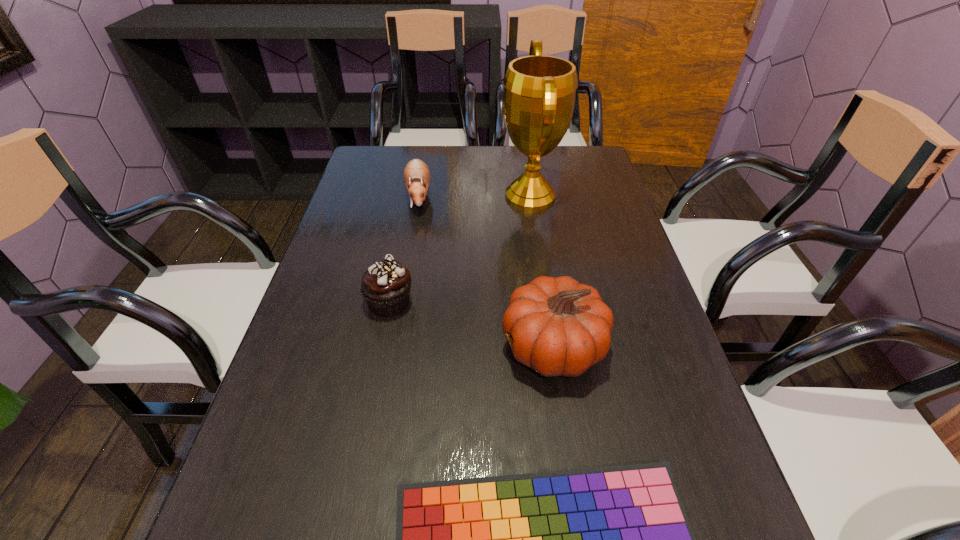
At what (x,y) coordinates should I click in order to perform the action: click on blank space located on the back of the cupcake. Please return your answer as a coordinate pair (x, y). The image size is (960, 540). Looking at the image, I should click on (409, 206).

Image resolution: width=960 pixels, height=540 pixels. In order to click on vacant point located 0.400m at the face of the hamster in this screenshot , I will do `click(396, 326)`.

The image size is (960, 540). I want to click on award that is positioned at the far edge, so click(x=539, y=91).

Locate an element on the screen. The image size is (960, 540). hamster at the far edge is located at coordinates (416, 173).

In order to click on object positioned at the left edge in this screenshot , I will do `click(385, 286)`.

In order to click on award situated at the right edge in this screenshot , I will do `click(539, 91)`.

Locate an element on the screen. This screenshot has height=540, width=960. pumpkin present at the right edge is located at coordinates (560, 327).

I want to click on object located in the far right corner section of the desktop, so click(x=539, y=91).

The height and width of the screenshot is (540, 960). Identify the location of free space at the far edge. (470, 155).

In the image, there is a desktop. Find the location of `blank space at the left edge`. blank space at the left edge is located at coordinates (337, 299).